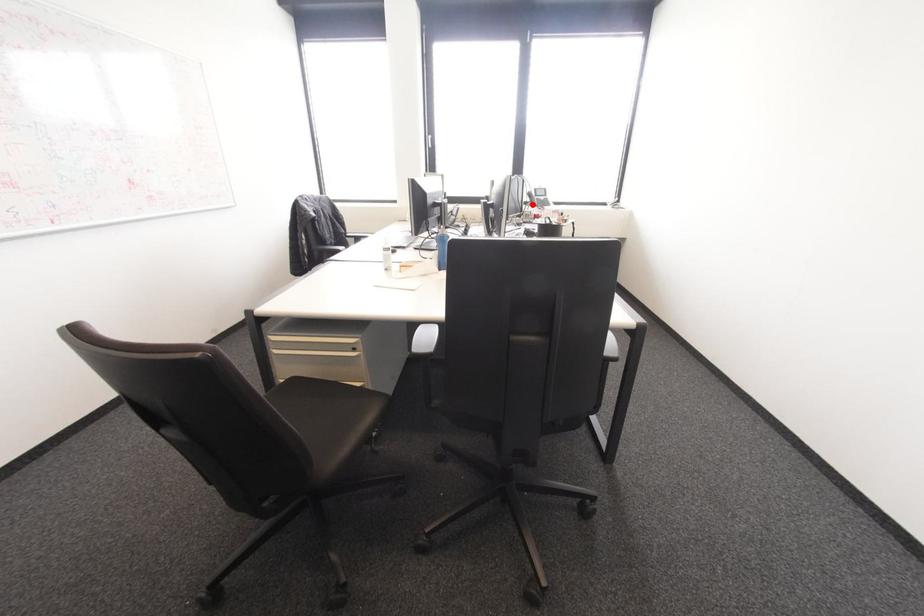
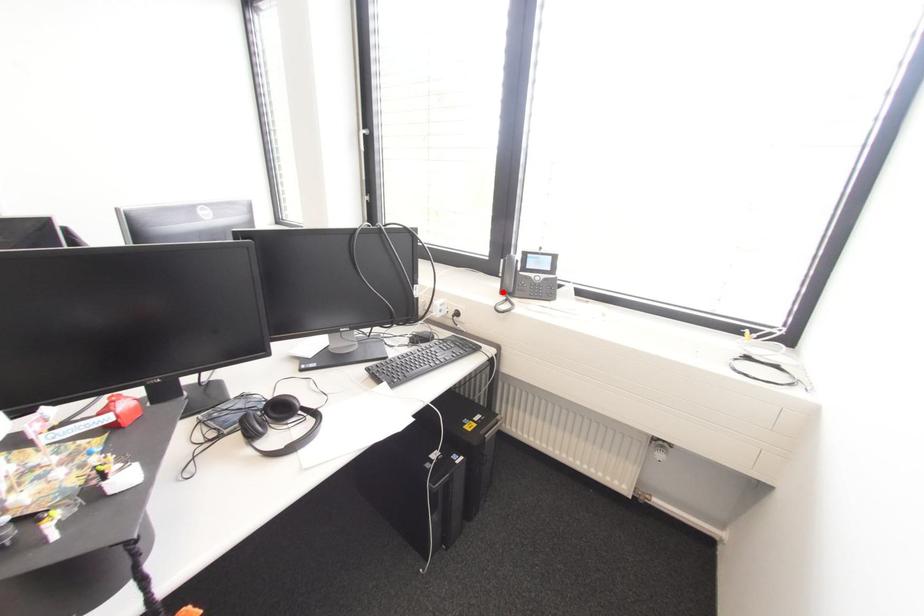
From the picture: I am providing you with two images of the same scene from different viewpoints. A red point is marked on the first image and another point is marked on the second image. Is the red point in image1 aligned with the point shown in image2?

Yes